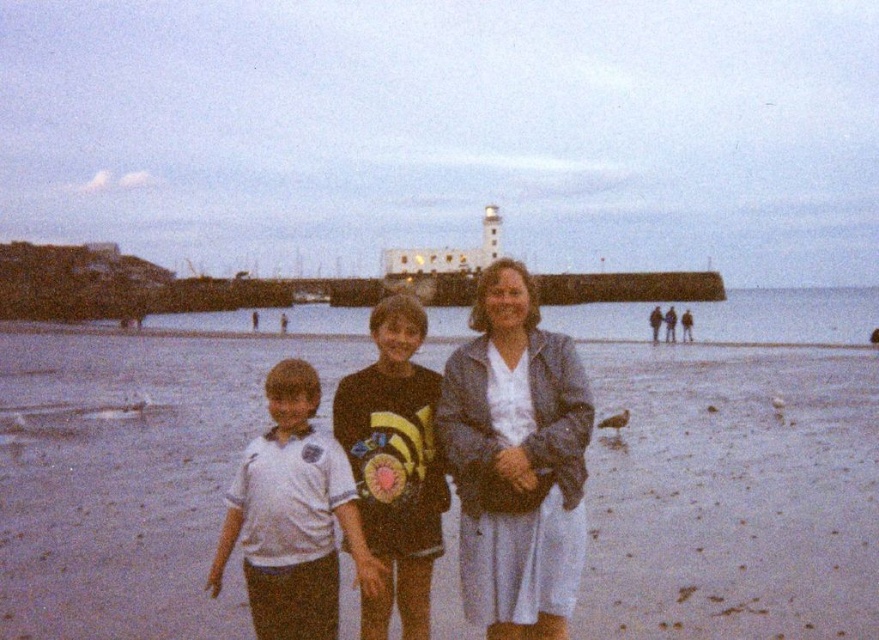
Can you confirm if white sand at center is shorter than white cotton shirt at center?

Correct, white sand at center is not as tall as white cotton shirt at center.

Which of these two, white sand at center or white cotton shirt at center, stands shorter?

Standing shorter between the two is white sand at center.

Does point (601, 349) come farther from viewer compared to point (315, 568)?

That is True.

Find the location of a particular element. white sand at center is located at coordinates (732, 496).

Does light blue fabric dress at center appear under matte gray jacket at center?

Yes.

Does point (473, 467) come in front of point (684, 317)?

That is True.

Between point (522, 618) and point (686, 323), which one is positioned in front?

Point (522, 618)

Identify the location of light blue fabric dress at center. The width and height of the screenshot is (879, 640). (516, 460).

Between white sand at center and black matte shorts at center, which one has more height?

black matte shorts at center is taller.

Is point (768, 490) positioned before point (343, 412)?

No, (768, 490) is behind (343, 412).

Where is `white sand at center`? white sand at center is located at coordinates (732, 496).